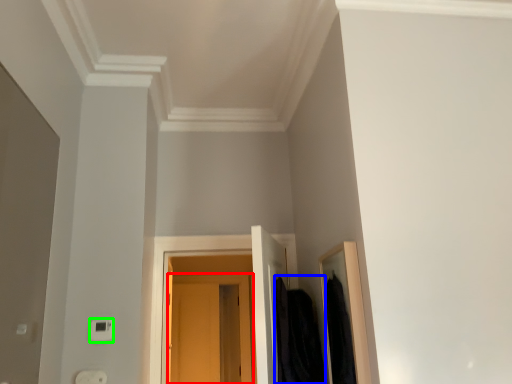
Question: Which object is positioned farthest from door (highlighted by a red box)? Select from clothing (highlighted by a blue box) and light switch (highlighted by a green box).

Choices:
 (A) clothing
 (B) light switch

Answer: (B)